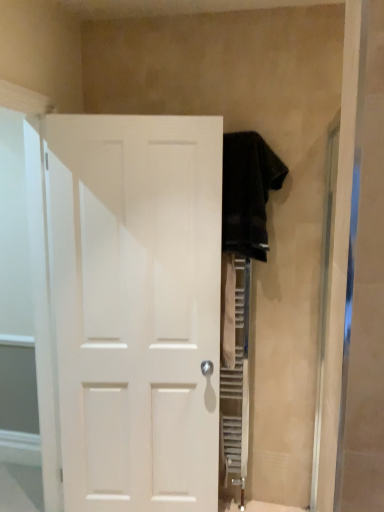
What is the approximate height of dark brown towel at upper right?

It is 26.23 inches.

Image resolution: width=384 pixels, height=512 pixels. What do you see at coordinates (248, 192) in the screenshot? I see `dark brown towel at upper right` at bounding box center [248, 192].

Identify the location of transparent glass door at left. The height and width of the screenshot is (512, 384). (26, 319).

Considering the points (168, 116) and (18, 288), which point is behind, point (168, 116) or point (18, 288)?

The point (18, 288) is behind.

Is white matte door at center situated inside transparent glass door at left or outside?

white matte door at center exists outside the volume of transparent glass door at left.

In the image, is white matte door at center positioned in front of or behind transparent glass door at left?

white matte door at center is behind transparent glass door at left.

From a real-world perspective, is white matte door at center below transparent glass door at left?

Yes.

Can you confirm if dark brown towel at upper right is positioned to the right of transparent glass door at left?

Yes.

Does dark brown towel at upper right turn towards transparent glass door at left?

No, dark brown towel at upper right does not turn towards transparent glass door at left.

From a real-world perspective, is dark brown towel at upper right located beneath transparent glass door at left?

Incorrect, from a real-world perspective, dark brown towel at upper right is higher than transparent glass door at left.

Between dark brown towel at upper right and white matte door at center, which one has more height?

white matte door at center is taller.

In the image, there is a dark brown towel at upper right. In order to click on door below it (from a real-world perspective) in this screenshot , I will do `click(136, 307)`.

From a real-world perspective, is dark brown towel at upper right over white matte door at center?

Indeed, from a real-world perspective, dark brown towel at upper right stands above white matte door at center.

How many degrees apart are the facing directions of white matte door at center and dark brown towel at upper right?

There is a 10.9-degree angle between the facing directions of white matte door at center and dark brown towel at upper right.

Are white matte door at center and dark brown towel at upper right beside each other?

There is a gap between white matte door at center and dark brown towel at upper right.

Could you tell me if white matte door at center is turned towards dark brown towel at upper right?

No.

Between white matte door at center and dark brown towel at upper right, which one appears on the left side from the viewer's perspective?

white matte door at center is more to the left.

Is transparent glass door at left wider than dark brown towel at upper right?

Incorrect, the width of transparent glass door at left does not surpass that of dark brown towel at upper right.

Is transparent glass door at left completely or partially outside of dark brown towel at upper right?

Absolutely, transparent glass door at left is external to dark brown towel at upper right.

What are the coordinates of `glass door lying in front of the dark brown towel at upper right` in the screenshot? It's located at (26, 319).

From the picture: Does transparent glass door at left come in front of dark brown towel at upper right?

Yes, transparent glass door at left is closer to the camera.

Is transparent glass door at left to the right of white matte door at center from the viewer's perspective?

In fact, transparent glass door at left is to the left of white matte door at center.

Considering the sizes of transparent glass door at left and white matte door at center in the image, is transparent glass door at left taller or shorter than white matte door at center?

Clearly, transparent glass door at left is taller compared to white matte door at center.

In terms of width, does transparent glass door at left look wider or thinner when compared to white matte door at center?

transparent glass door at left is wider than white matte door at center.

Does point (15, 186) lie in front of point (169, 347)?

No, (15, 186) is further to viewer.

This screenshot has width=384, height=512. In order to click on door on the right side of transparent glass door at left in this screenshot , I will do `click(136, 307)`.

Find the location of a particular element. clothing above the transparent glass door at left (from the image's perspective) is located at coordinates (248, 192).

From the image, which object appears to be nearer to white matte door at center, transparent glass door at left or dark brown towel at upper right?

transparent glass door at left.

Looking at the image, which one is located further to transparent glass door at left, white matte door at center or dark brown towel at upper right?

dark brown towel at upper right lies further to transparent glass door at left than the other object.

Estimate the real-world distances between objects in this image. Which object is further from white matte door at center, dark brown towel at upper right or transparent glass door at left?

Based on the image, dark brown towel at upper right appears to be further to white matte door at center.

Based on their spatial positions, is white matte door at center or transparent glass door at left closer to dark brown towel at upper right?

white matte door at center lies closer to dark brown towel at upper right than the other object.

Considering their positions, is dark brown towel at upper right positioned closer to transparent glass door at left than white matte door at center?

Based on the image, white matte door at center appears to be nearer to transparent glass door at left.

Considering their positions, is transparent glass door at left positioned closer to dark brown towel at upper right than white matte door at center?

white matte door at center.

Where is `door between transparent glass door at left and dark brown towel at upper right`? This screenshot has height=512, width=384. door between transparent glass door at left and dark brown towel at upper right is located at coordinates (136, 307).